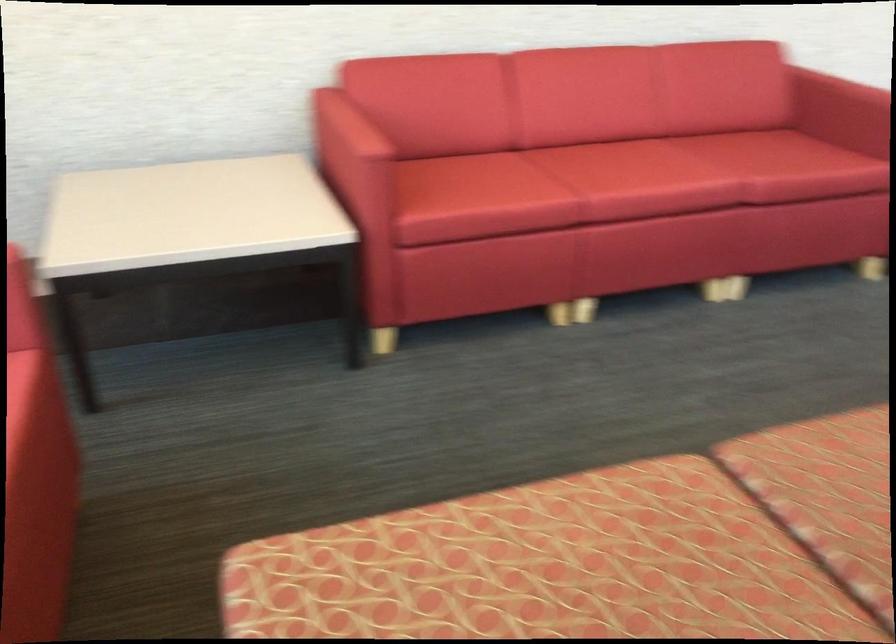
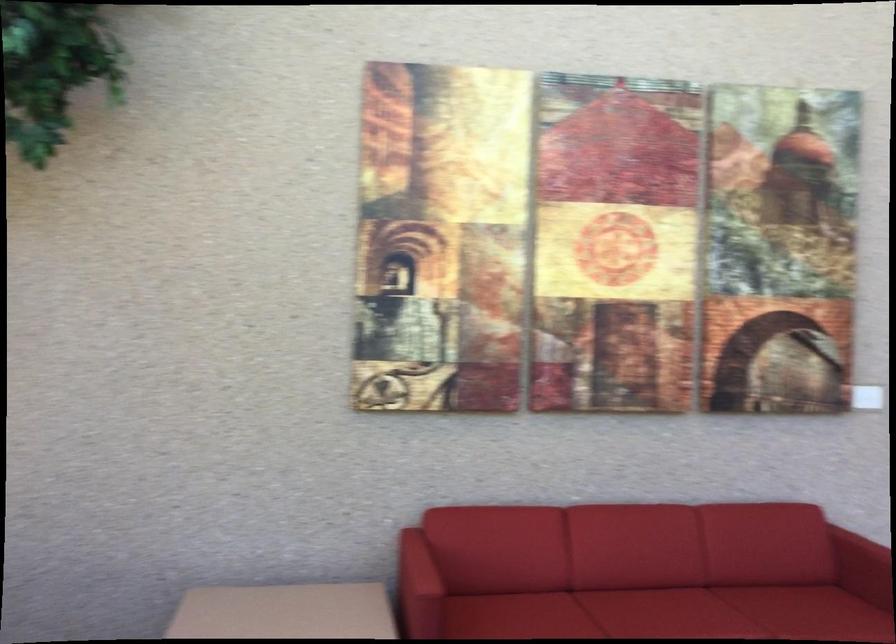
Where in the second image is the point corresponding to the point at 822,98 from the first image?

(864, 558)